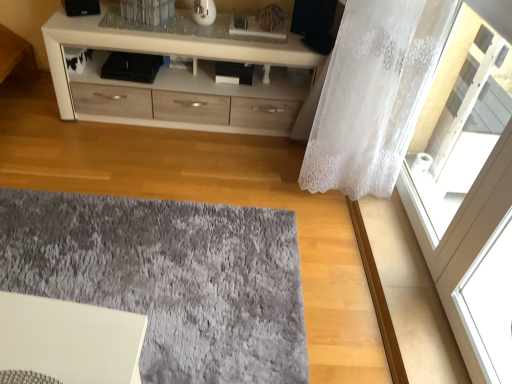
Question: Does point (334, 155) appear closer or farther from the camera than point (77, 258)?

Choices:
 (A) closer
 (B) farther

Answer: (B)

Question: From the image's perspective, is white lace curtain at right located above or below gray shaggy rug at center?

Choices:
 (A) below
 (B) above

Answer: (B)

Question: Which object is positioned farthest from the white lace curtain at right?

Choices:
 (A) gray shaggy rug at center
 (B) white lace curtain at right
 (C) white glossy cabinet at upper center

Answer: (A)

Question: Considering the real-world distances, which object is closest to the gray shaggy rug at center?

Choices:
 (A) white lace curtain at right
 (B) white lace curtain at right
 (C) white glossy cabinet at upper center

Answer: (A)